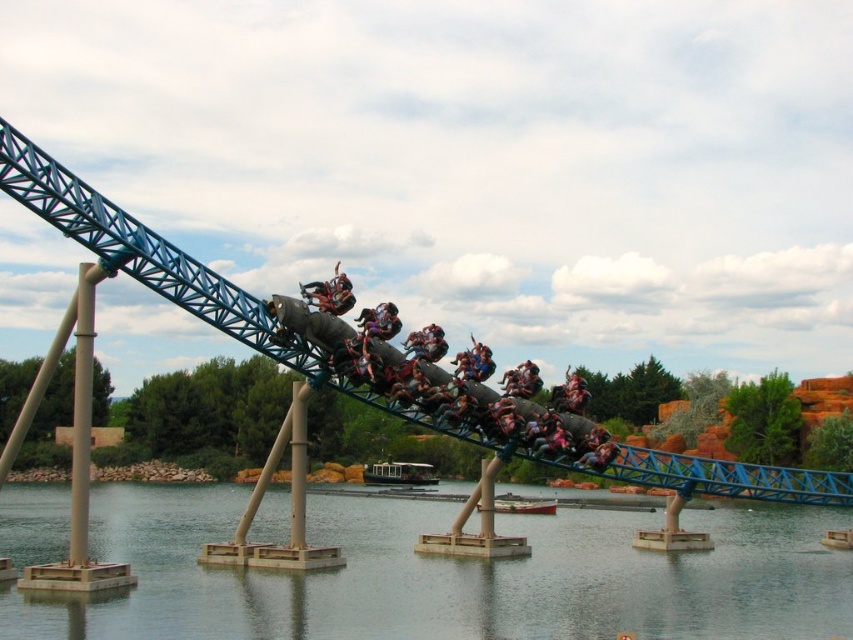
Can you confirm if transparent glass water at lower center is positioned above metallic gray roller coaster car at center?

No, transparent glass water at lower center is not above metallic gray roller coaster car at center.

Is transparent glass water at lower center below metallic gray roller coaster car at center?

Yes.

The width and height of the screenshot is (853, 640). In order to click on transparent glass water at lower center in this screenshot , I will do `click(451, 577)`.

Can you confirm if transparent glass water at lower center is positioned above metallic silver roller coaster car at center?

Incorrect, transparent glass water at lower center is not positioned above metallic silver roller coaster car at center.

Between transparent glass water at lower center and metallic silver roller coaster car at center, which one is positioned lower?

transparent glass water at lower center is lower down.

I want to click on transparent glass water at lower center, so click(451, 577).

Who is shorter, metallic gray roller coaster car at center or metallic silver roller coaster car at center?

Standing shorter between the two is metallic silver roller coaster car at center.

How distant is metallic gray roller coaster car at center from metallic silver roller coaster car at center?

The distance of metallic gray roller coaster car at center from metallic silver roller coaster car at center is 10.57 meters.

Locate an element on the screen. The image size is (853, 640). metallic gray roller coaster car at center is located at coordinates (440, 388).